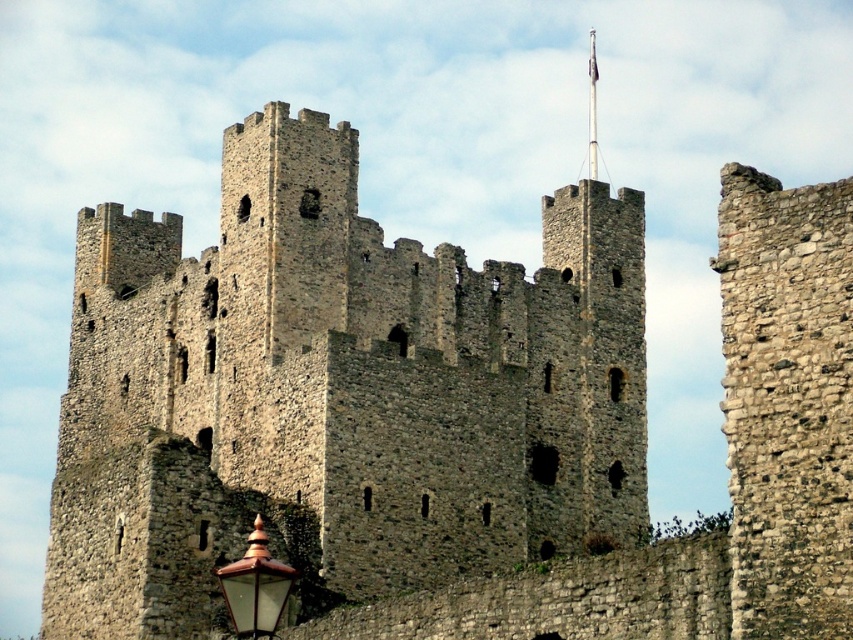
You are an architect examining the medieval stone castle. You notice the gray stone castle at center and the polished brass lantern at lower left. Which object would require more materials to construct based on their sizes?

The gray stone castle at center requires more materials to construct because it is larger in size compared to the polished brass lantern at lower left.

You are standing in front of the castle and see two points marked on the ground. The first point is at coordinates point (236, 305) and the second point is at point (259, 593). If you were to walk from the first point to the second point, would you be moving towards the castle or away from it?

Since point (236, 305) is behind point (259, 593), walking from the first point to the second point would mean moving towards the castle.

You are standing in front of the gray stone castle at center and want to place a decorative flagpole on the opposite side of the polished brass lantern at lower left. Based on their positions, which object is farther to the left?

The gray stone castle at center is to the left of the polished brass lantern at lower left, so the gray stone castle at center is farther to the left.